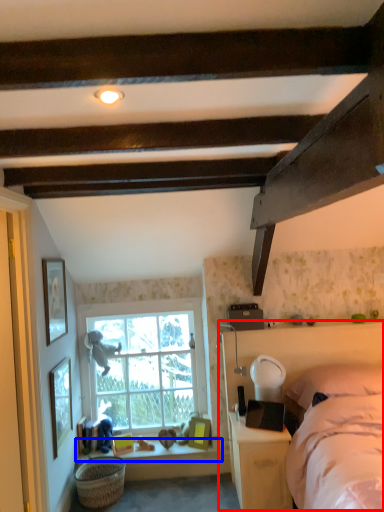
Question: Which of the following is the closest to the observer, bed frame (highlighted by a red box) or window sill (highlighted by a blue box)?

Choices:
 (A) bed frame
 (B) window sill

Answer: (A)